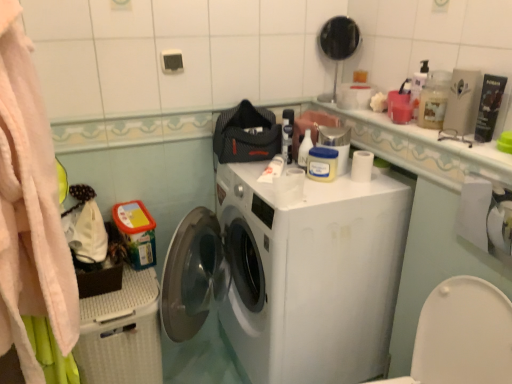
Identify the location of free spot to the left of translucent plastic bottle at upper right, acting as the 2th cleaning product starting from the left. The height and width of the screenshot is (384, 512). (397, 125).